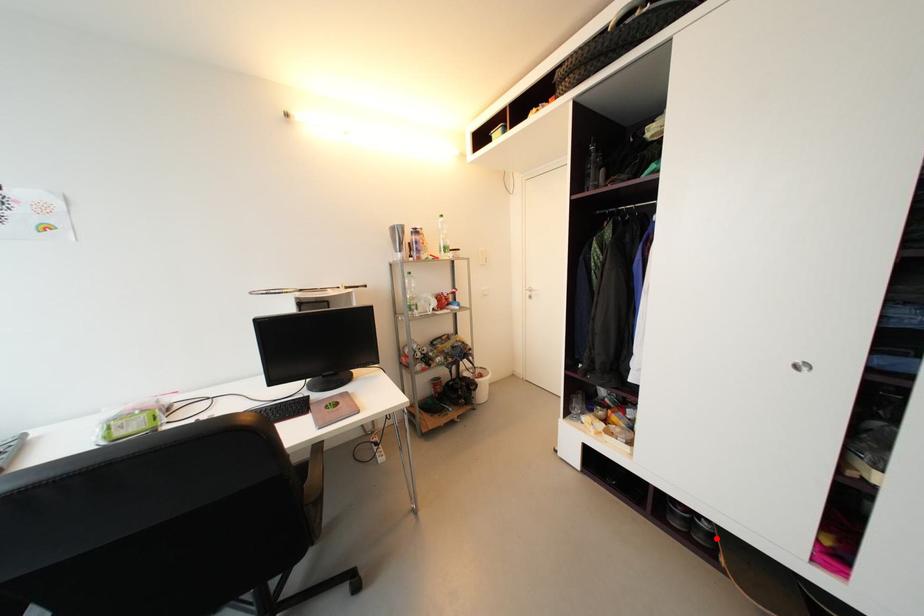
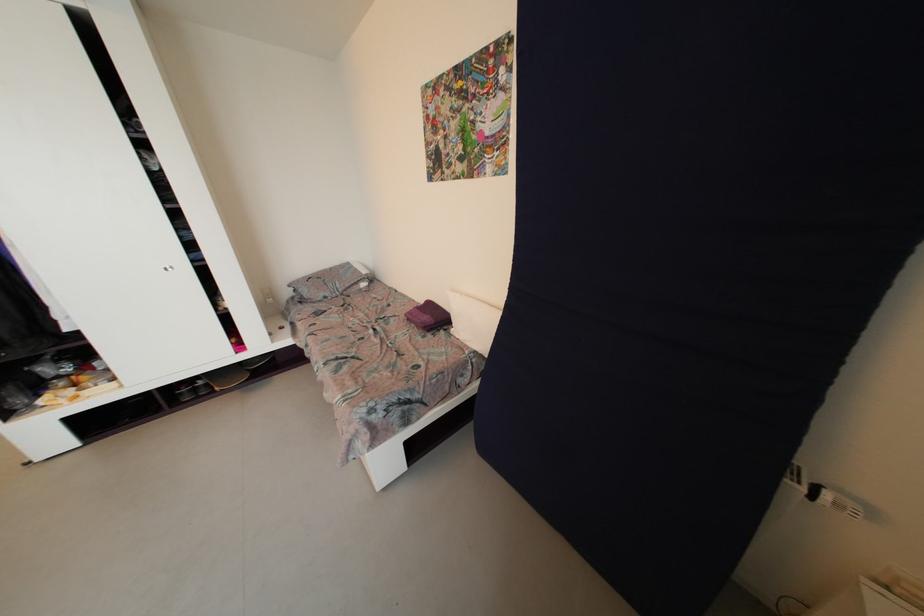
Question: I am providing you with two images of the same scene from different viewpoints. A red point is shown in image1. For the corresponding object point in image2, is it positioned nearer or farther from the camera?

Choices:
 (A) Nearer
 (B) Farther

Answer: (A)